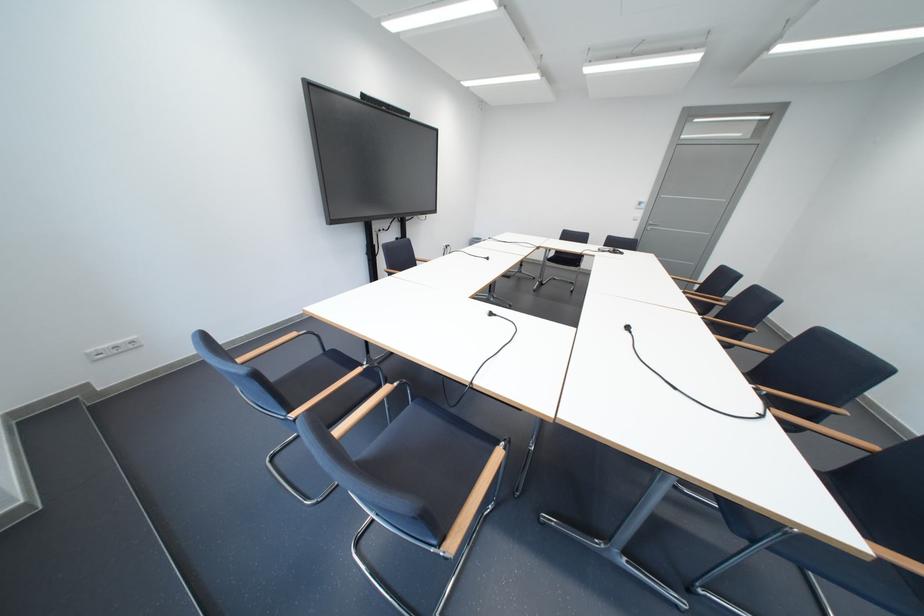
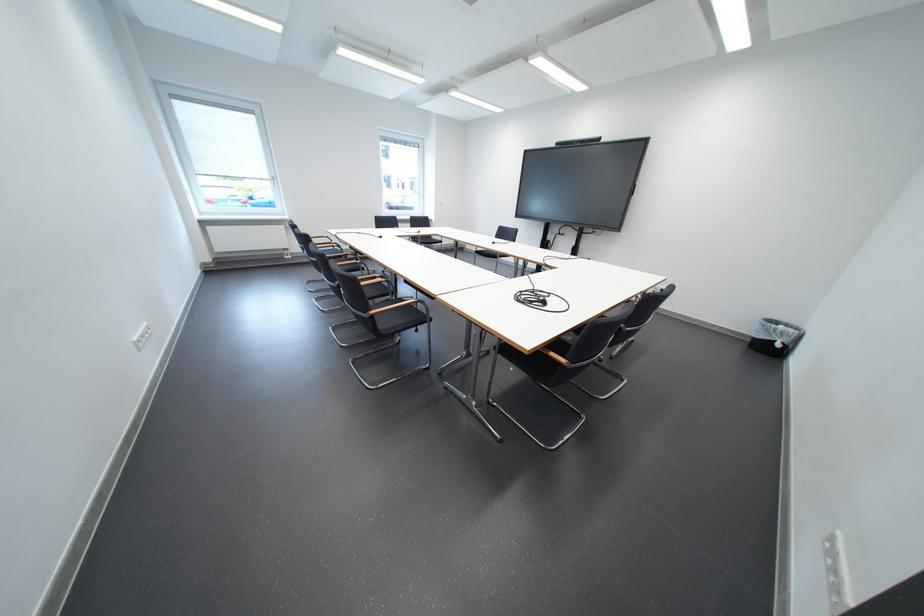
Question: I am providing you with two images of the same scene from different viewpoints. Please identify which objects are invisible in image2.

Choices:
 (A) wooden chair armrest
 (B) green android magnet
 (C) black trash can
 (D) black chair seat

Answer: (A)